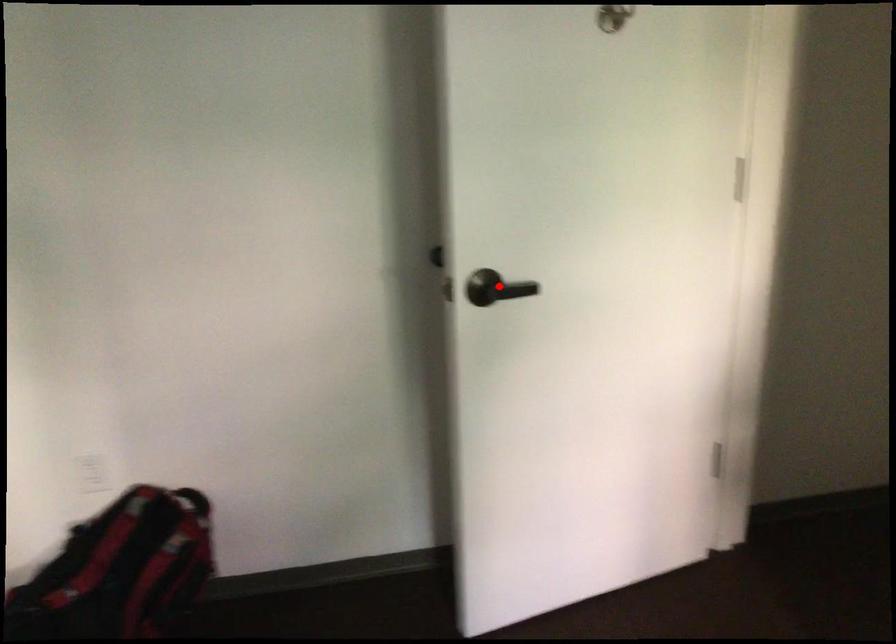
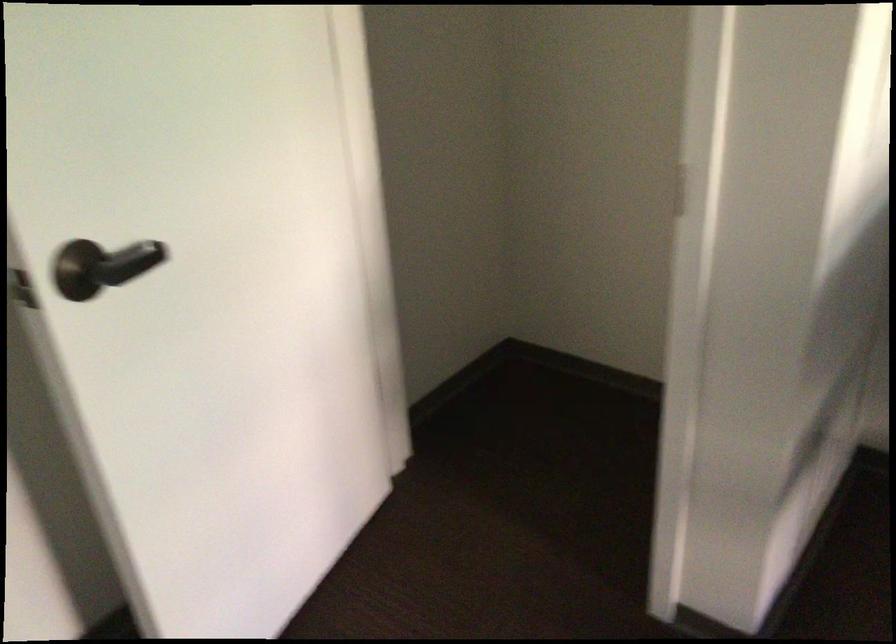
Question: I am providing you with two images of the same scene from different viewpoints. A red point is shown in image1. For the corresponding object point in image2, is it positioned nearer or farther from the camera?

Choices:
 (A) Nearer
 (B) Farther

Answer: (A)